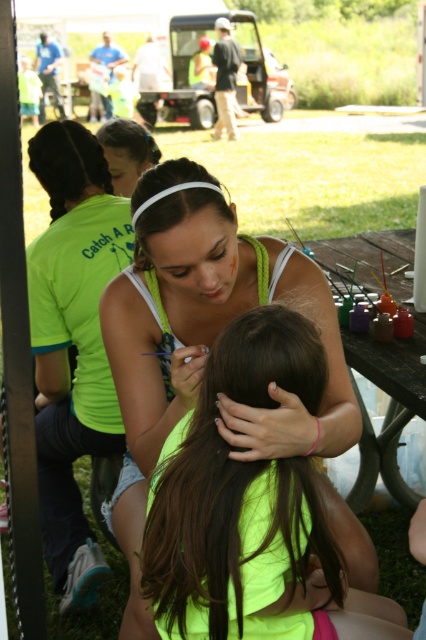
You are a photographer standing at a distance. You want to take a photo of the neon green tank top at center and dark brown hair at center. If your camera has a maximum focus range of 1.5 meters, will both subjects be in focus?

The neon green tank top at center is 1.61 meters away from dark brown hair at center. Since the maximum focus range is 1.5 meters, the distance between them exceeds the camera limit, so both subjects cannot be in focus simultaneously.

Based on the scene description, where exactly is the braided dark brown hair at upper left located?

The braided dark brown hair at upper left is located at point coordinates of (68, 163).

You are a photographer at the event and want to capture a photo that includes both the brown smooth hair at center and the dark brown hair at center. The minimum distance between the two subjects for your camera to focus properly is 2 meters. Will you be able to achieve proper focus with their current positions?

The brown smooth hair at center is 1.95 meters away from dark brown hair at center. Since the minimum required distance for proper focus is 2 meters, the camera cannot achieve proper focus with their current positions.